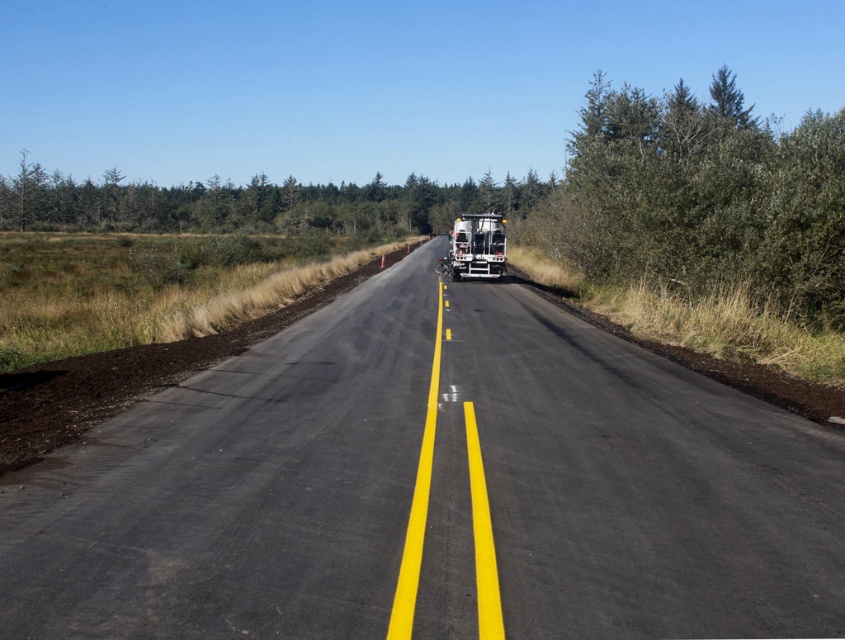
You are a driver approaching the black asphalt road at center and the green leafy trees at upper center. Which object appears taller from your perspective?

The green leafy trees at upper center appear taller than the black asphalt road at center from your perspective.

You are a delivery driver planning to pass a metallic silver trailer truck at center on a black asphalt road at center. Based on their widths, can you safely pass the truck on this road?

The black asphalt road at center is wider than the metallic silver trailer truck at center, so yes, you can safely pass the truck on the road as there is enough width available.

You are a pedestrian standing on the sidewalk and see the black asphalt road at center and the metallic silver trailer truck at center. Which object is located to the left of the other?

The black asphalt road at center is positioned on the left side of metallic silver trailer truck at center, so the black asphalt road at center is to the left of the metallic silver trailer truck at center.